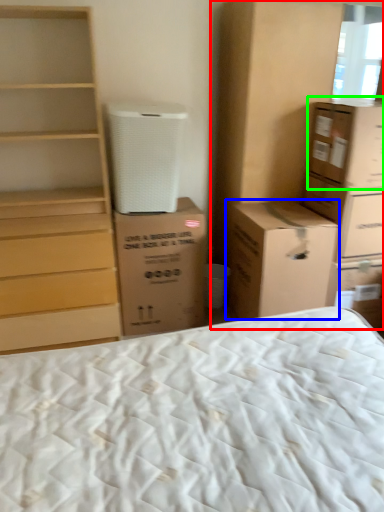
Question: Which object is the farthest from cabinetry (highlighted by a red box)? Choose among these: cardboard box (highlighted by a blue box) or cardboard box (highlighted by a green box).

Choices:
 (A) cardboard box
 (B) cardboard box

Answer: (A)